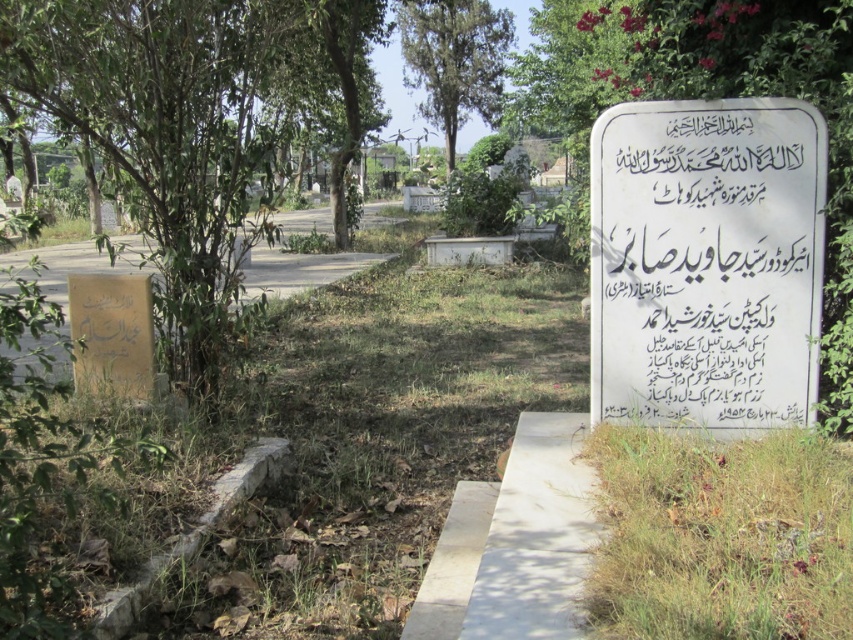
Question: Observing the image, what is the correct spatial positioning of green leafy tree at upper center in reference to yellow stone path at left?

Choices:
 (A) left
 (B) right

Answer: (B)

Question: Estimate the real-world distances between objects in this image. Which object is closer to the yellow stone path at left?

Choices:
 (A) green grass at lower right
 (B) green leafy tree at upper center

Answer: (B)

Question: Is green leafy tree at left below green leafy tree at upper center?

Choices:
 (A) no
 (B) yes

Answer: (B)

Question: Does green grass at lower right have a lesser width compared to green leafy tree at upper center?

Choices:
 (A) no
 (B) yes

Answer: (B)

Question: Estimate the real-world distances between objects in this image. Which object is closer to the green leafy tree at upper center?

Choices:
 (A) white paper sign at upper right
 (B) green grass at lower right

Answer: (A)

Question: Which point is farther to the camera?

Choices:
 (A) green leafy tree at upper center
 (B) white paper sign at upper right
 (C) yellow stone path at left
 (D) green leafy tree at left

Answer: (A)